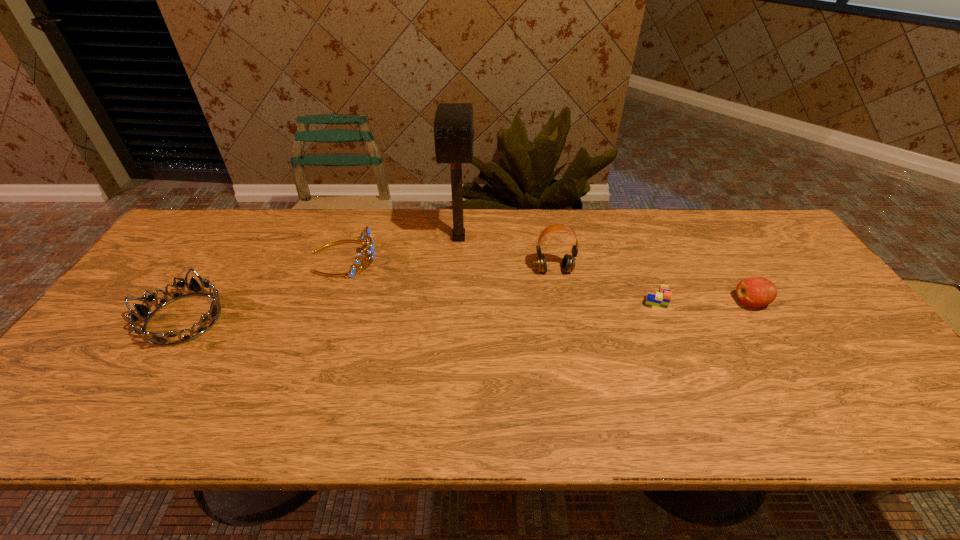
Identify the location of the shortest object. (660, 301).

The image size is (960, 540). Identify the location of free point located on the left of the fourth object from right to left. (332, 238).

The width and height of the screenshot is (960, 540). Identify the location of vacant area located on the ear cups of the fourth object from left to right. (564, 321).

At what (x,y) coordinates should I click in order to perform the action: click on vacant point located 0.210m on the front-facing side of the taller tiara. Please return your answer as a coordinate pair (x, y). The height and width of the screenshot is (540, 960). Looking at the image, I should click on (446, 258).

Identify the location of free location located on the front of the rightmost object. This screenshot has height=540, width=960. (780, 350).

The height and width of the screenshot is (540, 960). I want to click on free spot located 0.100m on the front-facing side of the leftmost object, so click(137, 390).

The width and height of the screenshot is (960, 540). In order to click on vacant space situated on the front of the Lego in this screenshot , I will do `click(694, 390)`.

Find the location of a particular element. This screenshot has width=960, height=540. mallet located at the far edge is located at coordinates (453, 125).

Where is `tiara located at the far edge`? The width and height of the screenshot is (960, 540). tiara located at the far edge is located at coordinates (365, 236).

Locate an element on the screen. This screenshot has width=960, height=540. object located in the left edge section of the desktop is located at coordinates (144, 312).